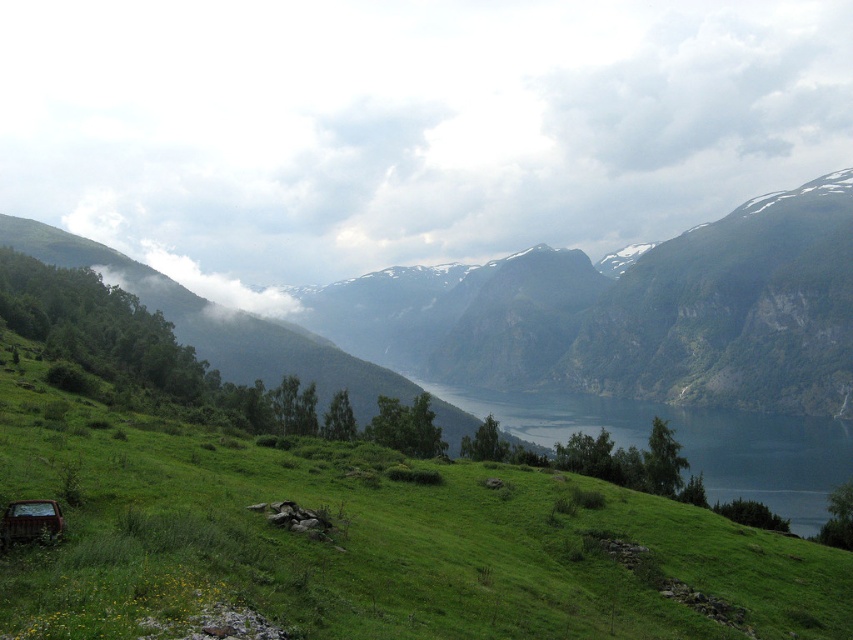
Question: Which point is closer to the camera?

Choices:
 (A) (335, 52)
 (B) (811, 96)

Answer: (B)

Question: Estimate the real-world distances between objects in this image. Which object is closer to the green grassy hillside at lower left?

Choices:
 (A) white fluffy cloud at upper right
 (B) white fluffy cloud at upper center

Answer: (B)

Question: Is white fluffy cloud at upper center further to the viewer compared to green grassy hillside at lower left?

Choices:
 (A) yes
 (B) no

Answer: (A)

Question: Which point is farther from the camera taking this photo?

Choices:
 (A) (585, 154)
 (B) (39, 465)
 (C) (369, 118)

Answer: (A)

Question: Is white fluffy cloud at upper center positioned behind white fluffy cloud at upper right?

Choices:
 (A) yes
 (B) no

Answer: (B)

Question: Is white fluffy cloud at upper center to the right of white fluffy cloud at upper right from the viewer's perspective?

Choices:
 (A) no
 (B) yes

Answer: (A)